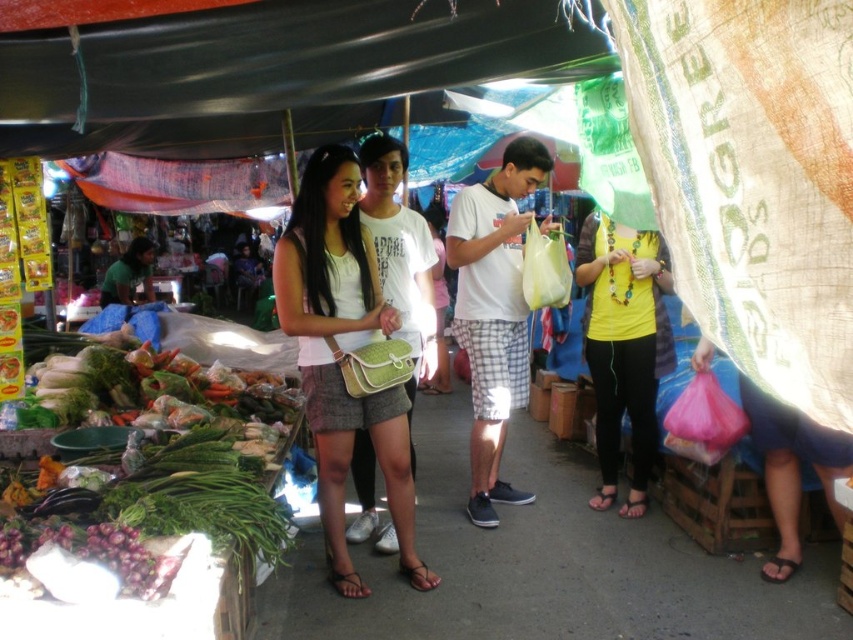
Question: Is matte green purse at center closer to camera compared to yellow matte shirt at center?

Choices:
 (A) yes
 (B) no

Answer: (B)

Question: Which of these objects is positioned closest to the white matte plastic bag at center?

Choices:
 (A) matte white tank top at center
 (B) green leafy vegetables at left
 (C) matte green purse at center
 (D) yellow matte shirt at center

Answer: (C)

Question: Which point appears closest to the camera in this image?

Choices:
 (A) (505, 365)
 (B) (35, 499)

Answer: (B)

Question: Where is green leafy vegetables at left located in relation to matte green purse at center in the image?

Choices:
 (A) below
 (B) above

Answer: (A)

Question: Does matte green purse at center have a larger size compared to white matte plastic bag at center?

Choices:
 (A) no
 (B) yes

Answer: (B)

Question: Which point is closer to the camera?

Choices:
 (A) white matte plastic bag at center
 (B) matte white tank top at center

Answer: (B)